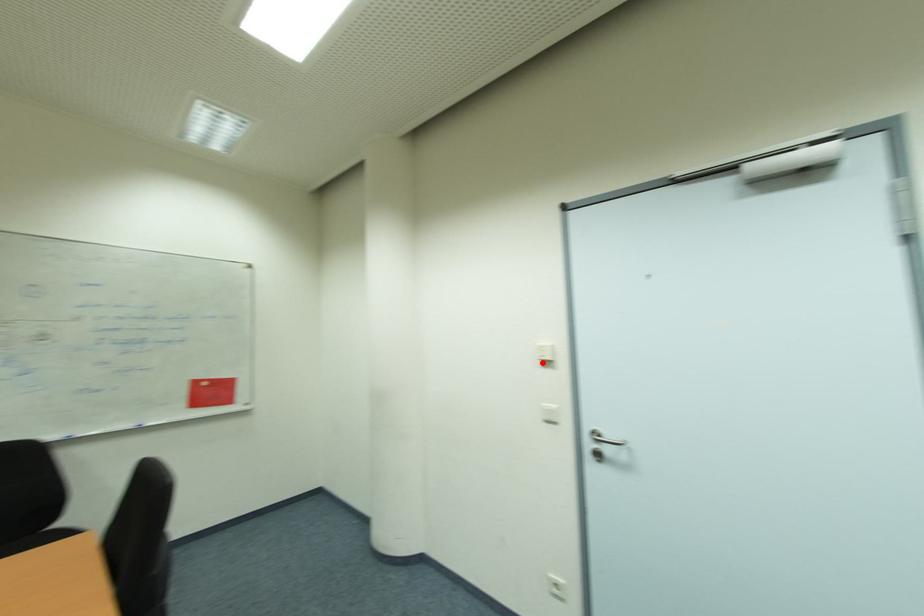
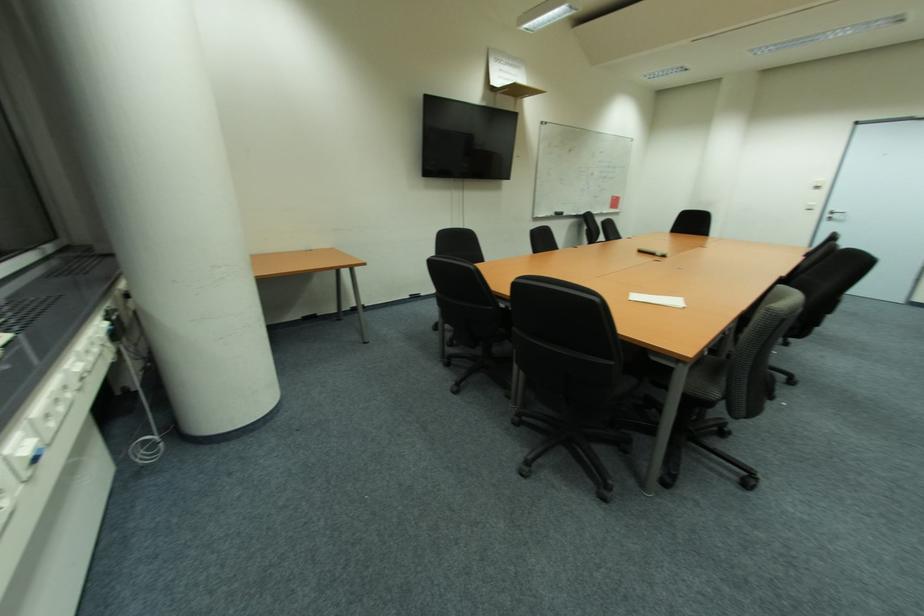
Question: I am providing you with two images of the same scene from different viewpoints. A red point is marked on the first image. Is the red point's position out of view in image 2?

Choices:
 (A) Yes
 (B) No

Answer: (B)